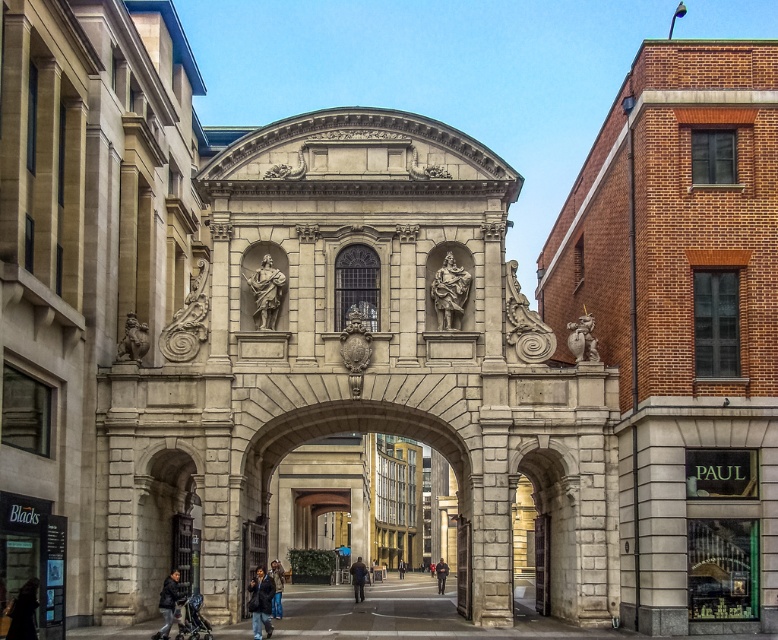
You are an architect designing a new plaza and want to place the polished stone statue at center and dark blue jeans at lower center in the plaza. Given their sizes, which object should be placed closer to the entrance to ensure proper visibility?

The polished stone statue at center has a smaller size compared to dark blue jeans at lower center, so the smaller statue should be placed closer to the entrance to ensure it is visible from a distance, while the larger dark blue jeans at lower center can be positioned further back.